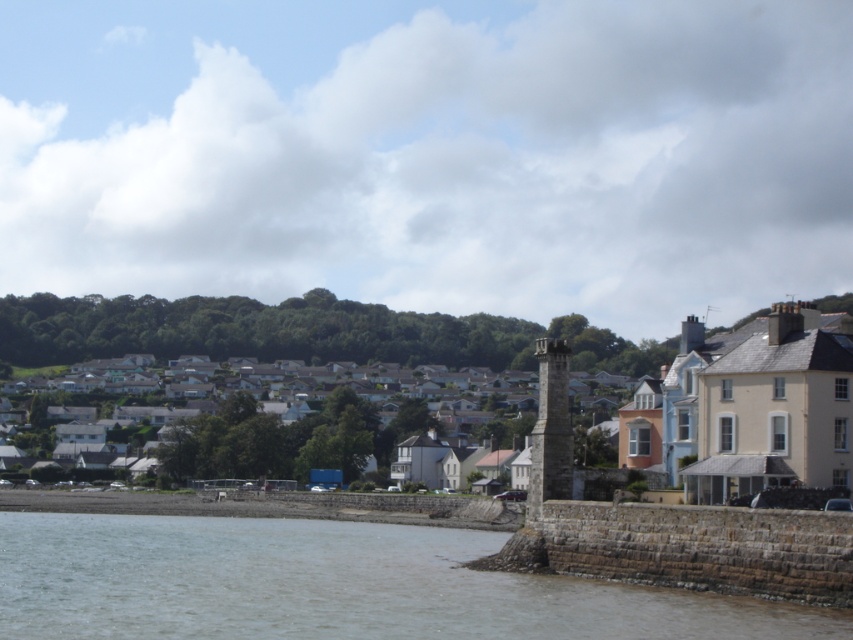
You are a tourist standing at the edge of the brown stone wall at lower left, looking towards the white matte houses at center. Which structure appears taller from your viewpoint?

The white matte houses at center appear taller than the brown stone wall at lower left because the brown stone wall at lower left has a lesser height compared to white matte houses at center.

Based on the photo, you are a surveyor measuring distances between landmarks in the coastal town. You need to determine if the distance between the brown stone wall at lower left and the white matte houses at center is suitable for installing a new 80 meter long bridge. Can you confirm if the distance is sufficient?

The brown stone wall at lower left and white matte houses at center are 77.75 meters apart. Since the required bridge length is 80 meters, the distance is insufficient by 2.25 meters. The bridge would not fit between them.